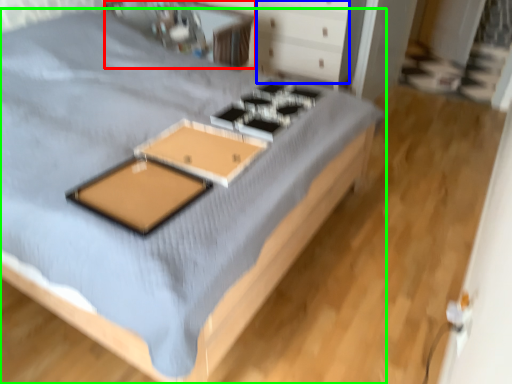
Question: Which object is the closest to the table (highlighted by a red box)? Choose among these: drawer (highlighted by a blue box) or bed (highlighted by a green box).

Choices:
 (A) drawer
 (B) bed

Answer: (A)